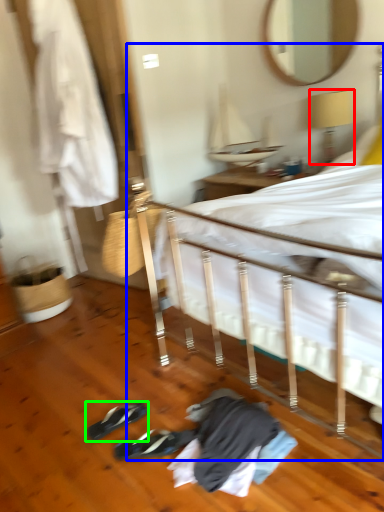
Question: Estimate the real-world distances between objects in this image. Which object is closer to lamp (highlighted by a red box), bed (highlighted by a blue box) or footwear (highlighted by a green box)?

Choices:
 (A) bed
 (B) footwear

Answer: (A)